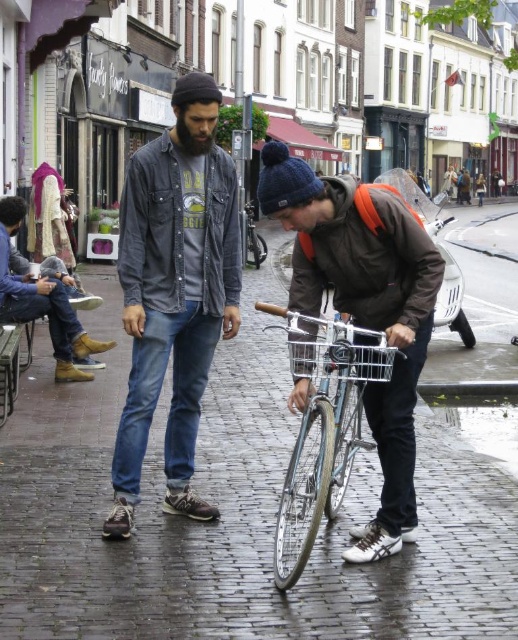
Question: Which of the following is the farthest from the observer?

Choices:
 (A) metallic silver basket at center
 (B) denim shirt at center
 (C) leather boots at lower left
 (D) wet cobblestone pavement at center

Answer: (C)

Question: Can you confirm if matte brown jacket at center is smaller than leather boots at lower left?

Choices:
 (A) yes
 (B) no

Answer: (B)

Question: Is denim shirt at center further to camera compared to leather boots at lower left?

Choices:
 (A) yes
 (B) no

Answer: (B)

Question: Can you confirm if denim shirt at center is thinner than shiny silver bicycle at center?

Choices:
 (A) no
 (B) yes

Answer: (A)

Question: Among these points, which one is farthest from the camera?

Choices:
 (A) (160, 595)
 (B) (326, 368)
 (C) (6, 257)
 (D) (255, 218)

Answer: (D)

Question: Which of the following is the closest to the observer?

Choices:
 (A) (394, 525)
 (B) (18, 278)

Answer: (A)